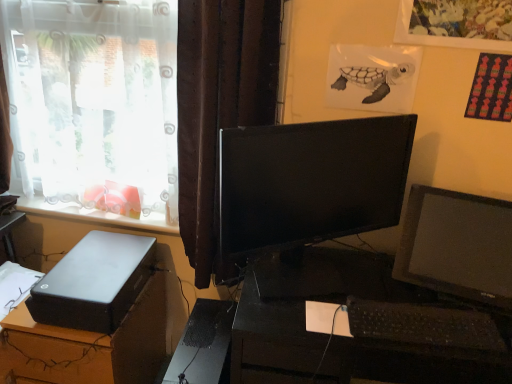
This screenshot has height=384, width=512. In order to click on free space behind black plastic keyboard at lower right in this screenshot , I will do `click(382, 279)`.